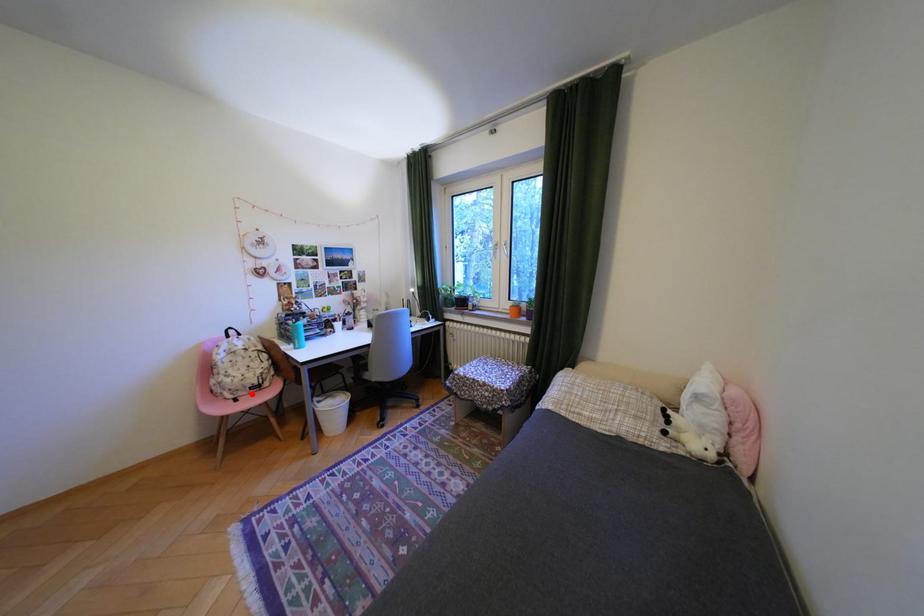
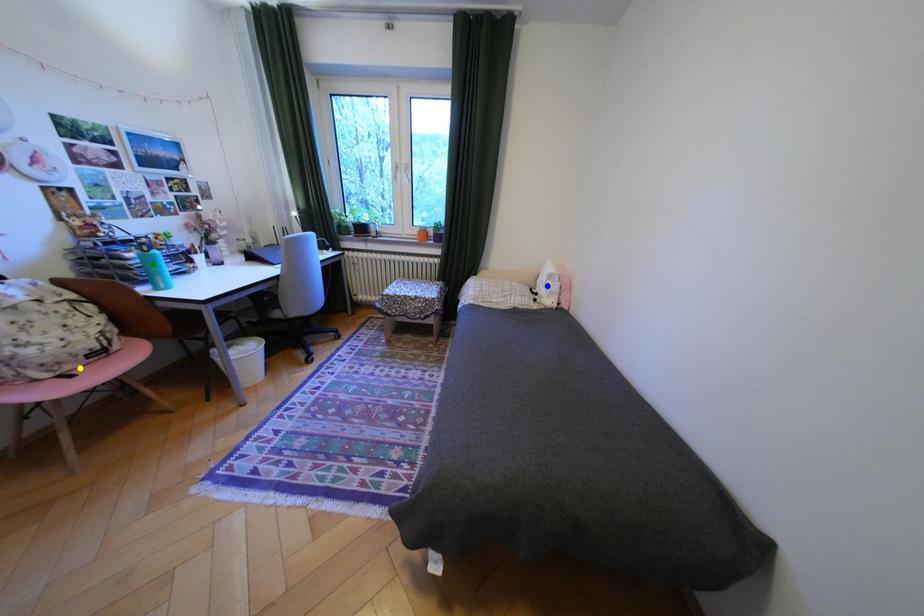
Question: I am providing you with two images of the same scene from different viewpoints. A red point is marked on the first image. You are given multiple points on the second image. Which mark in image 2 goes with the point in image 1?

Choices:
 (A) yellow point
 (B) blue point
 (C) green point

Answer: (A)